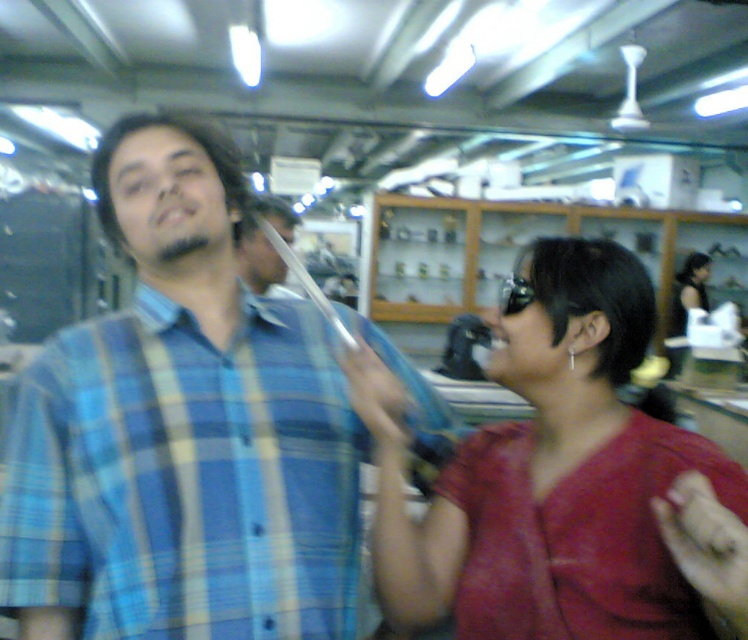
Who is shorter, blue plaid shirt at center or smooth black hair at center?

smooth black hair at center

Which is above, blue plaid shirt at center or smooth black hair at center?

Positioned higher is smooth black hair at center.

Which is behind, point (275, 406) or point (257, 202)?

Point (257, 202)

Identify the location of blue plaid shirt at center. Image resolution: width=748 pixels, height=640 pixels. (186, 477).

Which of these two, blue plaid shirt at center or shiny red fabric at center, stands shorter?

Standing shorter between the two is blue plaid shirt at center.

Can you confirm if blue plaid shirt at center is taller than shiny red fabric at center?

In fact, blue plaid shirt at center may be shorter than shiny red fabric at center.

Image resolution: width=748 pixels, height=640 pixels. Find the location of `blue plaid shirt at center`. blue plaid shirt at center is located at coordinates (186, 477).

Can you confirm if shiny red fabric at center is positioned above smooth black hair at center?

Actually, shiny red fabric at center is below smooth black hair at center.

The image size is (748, 640). Describe the element at coordinates (557, 477) in the screenshot. I see `shiny red fabric at center` at that location.

At what (x,y) coordinates should I click in order to perform the action: click on shiny red fabric at center. Please return your answer as a coordinate pair (x, y). This screenshot has width=748, height=640. Looking at the image, I should click on (557, 477).